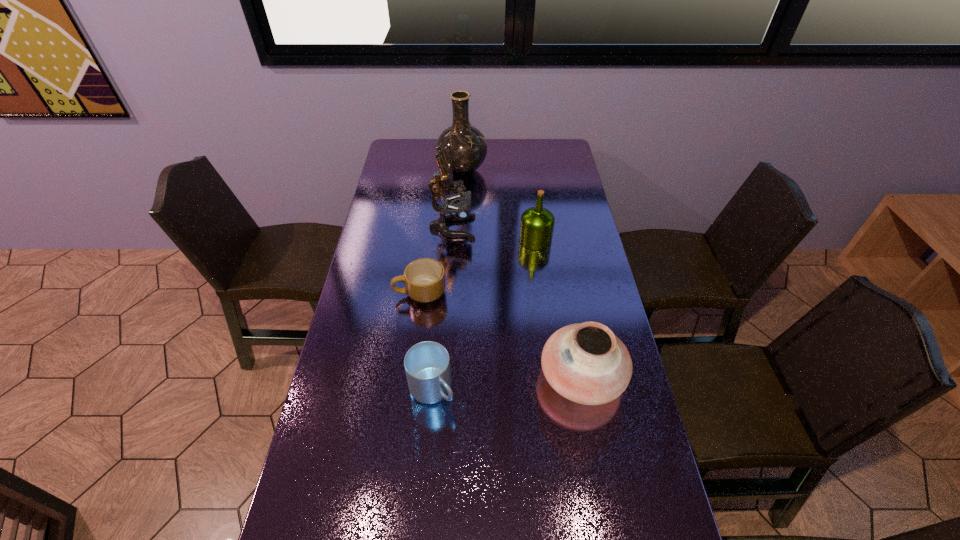
At what (x,y) coordinates should I click in order to perform the action: click on blank area located 0.360m on the left of the olive oil. Please return your answer as a coordinate pair (x, y). This screenshot has height=540, width=960. Looking at the image, I should click on (x=421, y=240).

In order to click on free space located 0.330m on the back of the third shortest object in this screenshot , I will do `click(562, 265)`.

Identify the location of vacant space located 0.210m on the back of the second shortest object. (439, 311).

This screenshot has width=960, height=540. I want to click on free point located 0.090m on the side with the handle of the shorter mug, so click(x=367, y=293).

Find the location of `vacant space located on the side with the handle of the shorter mug`. vacant space located on the side with the handle of the shorter mug is located at coordinates (364, 293).

At what (x,y) coordinates should I click in order to perform the action: click on object at the far edge. Please return your answer as a coordinate pair (x, y). The image size is (960, 540). Looking at the image, I should click on (465, 147).

You are a GUI agent. You are given a task and a screenshot of the screen. Output one action in this format:
    pyautogui.click(x=<x>, y=<y>)
    Task: Click on the object located at the left edge
    Image resolution: width=960 pixels, height=540 pixels.
    Given the screenshot: What is the action you would take?
    pyautogui.click(x=424, y=278)

Image resolution: width=960 pixels, height=540 pixels. I want to click on olive oil that is at the right edge, so click(537, 223).

At what (x,y) coordinates should I click in order to perform the action: click on pottery located at the right edge. Please return your answer as a coordinate pair (x, y). This screenshot has width=960, height=540. Looking at the image, I should click on (586, 363).

The image size is (960, 540). In the image, there is a desktop. Identify the location of free region at the far edge. (501, 150).